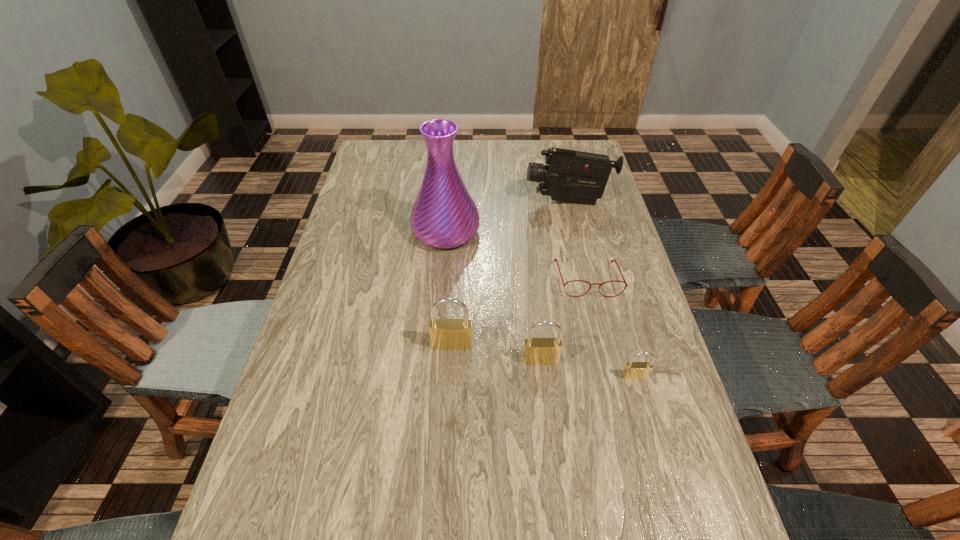
This screenshot has height=540, width=960. Identify the location of free space for a new padlock on the left. (368, 330).